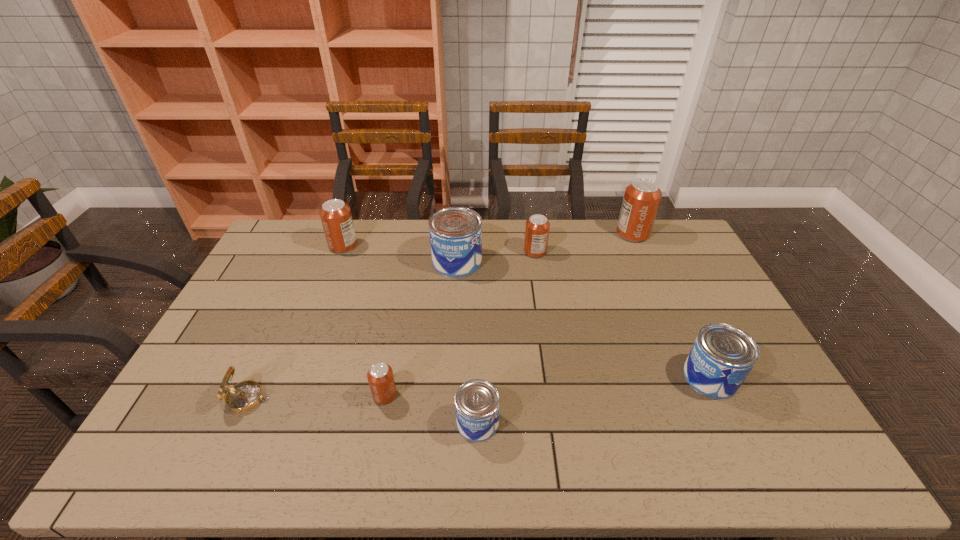
The width and height of the screenshot is (960, 540). I want to click on vacant area that lies between the second biggest blue can and the third smallest orange can, so click(527, 312).

Where is `object that stands as the fifth closest to the nearest blue can`? object that stands as the fifth closest to the nearest blue can is located at coordinates (537, 227).

Locate an element on the screen. object that ranks as the closest to the nearest orange can is located at coordinates (477, 402).

Identify which can is the fourth nearest to the fifth can from left to right. Please provide its 2D coordinates. Your answer should be formatted as a tuple, i.e. [(x, y)], where the tuple contains the x and y coordinates of a point satisfying the conditions above.

[(477, 402)]

You are a GUI agent. You are given a task and a screenshot of the screen. Output one action in this format:
    pyautogui.click(x=<x>, y=<y>)
    Task: Click on the can object that ranks as the fifth closest to the nearest orange can
    This screenshot has width=960, height=540.
    Given the screenshot: What is the action you would take?
    pyautogui.click(x=722, y=356)

Choose which orange can is the fourth nearest neighbor to the nearest blue can. Please provide its 2D coordinates. Your answer should be formatted as a tuple, i.e. [(x, y)], where the tuple contains the x and y coordinates of a point satisfying the conditions above.

[(642, 197)]

Identify which orange can is the closest to the second can from left to right. Please provide its 2D coordinates. Your answer should be formatted as a tuple, i.e. [(x, y)], where the tuple contains the x and y coordinates of a point satisfying the conditions above.

[(335, 215)]

You are a GUI agent. You are given a task and a screenshot of the screen. Output one action in this format:
    pyautogui.click(x=<x>, y=<y>)
    Task: Click on the blue can that can be found as the closest to the compass
    The image size is (960, 540).
    Given the screenshot: What is the action you would take?
    pyautogui.click(x=477, y=402)

Choose which blue can is the second nearest neighbor to the third biggest orange can. Please provide its 2D coordinates. Your answer should be formatted as a tuple, i.e. [(x, y)], where the tuple contains the x and y coordinates of a point satisfying the conditions above.

[(722, 356)]

Image resolution: width=960 pixels, height=540 pixels. I want to click on blank area in the image that satisfies the following two spatial constraints: 1. on the front label of the biggest blue can; 2. on the front side of the third orange can from right to left, so click(x=448, y=395).